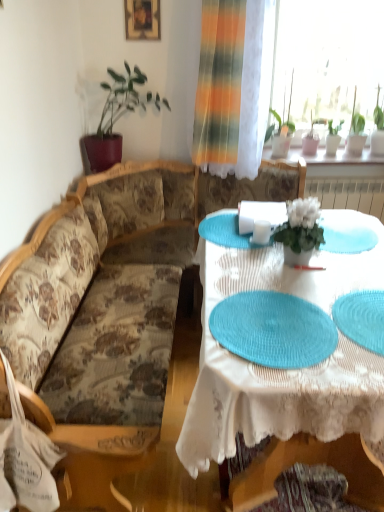
Question: Would you say blue woven placemat at lower right is a long distance from green matte plant at upper right, the fourth houseplant viewed from the left?

Choices:
 (A) yes
 (B) no

Answer: (A)

Question: Is blue woven placemat at lower right oriented away from green matte plant at upper right, which is the second houseplant from right to left?

Choices:
 (A) yes
 (B) no

Answer: (B)

Question: Does blue woven placemat at lower right have a lesser height compared to green matte plant at upper right, the fourth houseplant viewed from the left?

Choices:
 (A) no
 (B) yes

Answer: (B)

Question: Considering the relative sizes of blue woven placemat at lower right and green matte plant at upper right, which appears as the fifth houseplant when viewed from the front, in the image provided, is blue woven placemat at lower right smaller than green matte plant at upper right, which appears as the fifth houseplant when viewed from the front,?

Choices:
 (A) yes
 (B) no

Answer: (A)

Question: Does blue woven placemat at lower right appear on the right side of green matte plant at upper right, arranged as the first houseplant when viewed from the back?

Choices:
 (A) no
 (B) yes

Answer: (A)

Question: Considering the positions of point (375, 309) and point (354, 135), is point (375, 309) closer or farther from the camera than point (354, 135)?

Choices:
 (A) closer
 (B) farther

Answer: (A)

Question: From the image's perspective, is blue woven placemat at lower right located above or below green leafy plant at upper right, which is the 5th houseplant from left to right?

Choices:
 (A) below
 (B) above

Answer: (A)

Question: Considering the positions of blue woven placemat at lower right and green leafy plant at upper right, which is the 1th houseplant from right to left, in the image, is blue woven placemat at lower right wider or thinner than green leafy plant at upper right, which is the 1th houseplant from right to left,?

Choices:
 (A) wide
 (B) thin

Answer: (A)

Question: Is blue woven placemat at lower right inside or outside of green leafy plant at upper right, which ranks as the fourth houseplant in front-to-back order?

Choices:
 (A) outside
 (B) inside

Answer: (A)

Question: Is floral fabric couch at left taller or shorter than green leafy plant at upper left, placed as the 5th houseplant when sorted from right to left?

Choices:
 (A) tall
 (B) short

Answer: (A)

Question: In the image, is floral fabric couch at left on the left side or the right side of green leafy plant at upper left, the first houseplant in the left-to-right sequence?

Choices:
 (A) left
 (B) right

Answer: (B)

Question: Considering their positions, is floral fabric couch at left located in front of or behind green leafy plant at upper left, placed as the 5th houseplant when sorted from right to left?

Choices:
 (A) behind
 (B) front

Answer: (B)

Question: Looking at the image, does floral fabric couch at left seem bigger or smaller compared to green leafy plant at upper left, the first houseplant in the left-to-right sequence?

Choices:
 (A) small
 (B) big

Answer: (B)

Question: Considering the positions of green matte plant at upper right, which appears as the fifth houseplant when viewed from the front, and teal woven placemat at center in the image, is green matte plant at upper right, which appears as the fifth houseplant when viewed from the front, wider or thinner than teal woven placemat at center?

Choices:
 (A) wide
 (B) thin

Answer: (B)

Question: Which is correct: green matte plant at upper right, arranged as the first houseplant when viewed from the back, is inside teal woven placemat at center, or outside of it?

Choices:
 (A) inside
 (B) outside

Answer: (B)